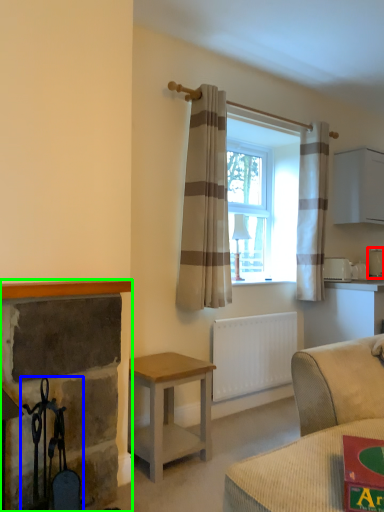
Question: Which object is the farthest from appliance (highlighted by a red box)? Choose among these: chair (highlighted by a blue box) or fireplace (highlighted by a green box).

Choices:
 (A) chair
 (B) fireplace

Answer: (A)